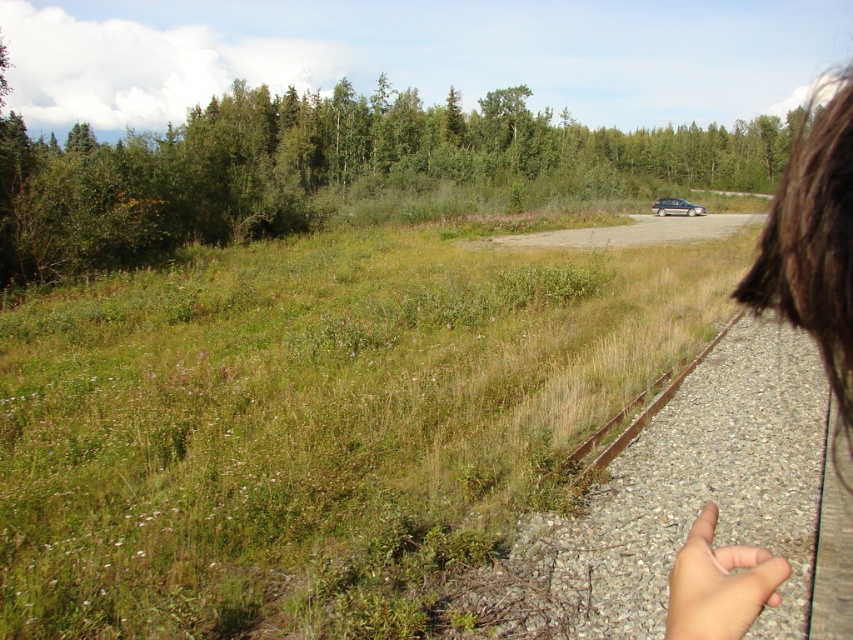
Question: Which object is farther from the camera taking this photo?

Choices:
 (A) green leafy tree at upper center
 (B) brown hair at upper right
 (C) satin silver hatchback at far right

Answer: (C)

Question: Observing the image, what is the correct spatial positioning of satin silver hatchback at far right in reference to clear glass window at center?

Choices:
 (A) below
 (B) above

Answer: (A)

Question: Considering the relative positions of green leafy tree at upper center and clear glass window at center in the image provided, where is green leafy tree at upper center located with respect to clear glass window at center?

Choices:
 (A) below
 (B) above

Answer: (B)

Question: Which is farther from the green leafy tree at upper center?

Choices:
 (A) clear glass window at center
 (B) brown hair at upper right

Answer: (B)

Question: Does green leafy tree at upper center appear under satin silver hatchback at far right?

Choices:
 (A) no
 (B) yes

Answer: (A)

Question: Among these points, which one is farthest from the camera?

Choices:
 (A) (693, 205)
 (B) (844, 104)
 (C) (91, 140)
 (D) (656, 205)

Answer: (C)